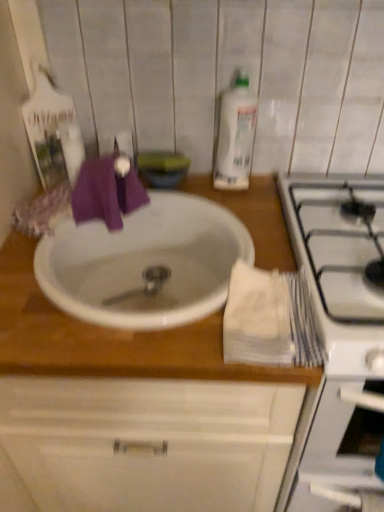
The width and height of the screenshot is (384, 512). I want to click on free space above white matte sink at center (from a real-world perspective), so click(x=199, y=302).